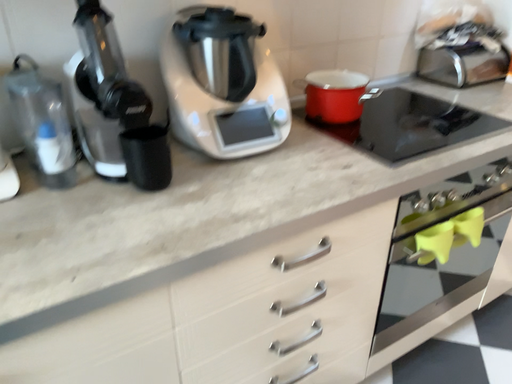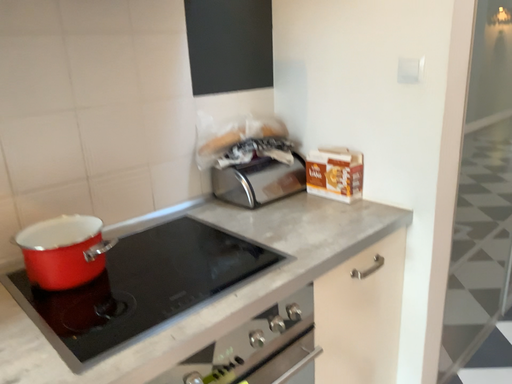
Question: How did the camera likely rotate when shooting the video?

Choices:
 (A) rotated right
 (B) rotated left

Answer: (A)